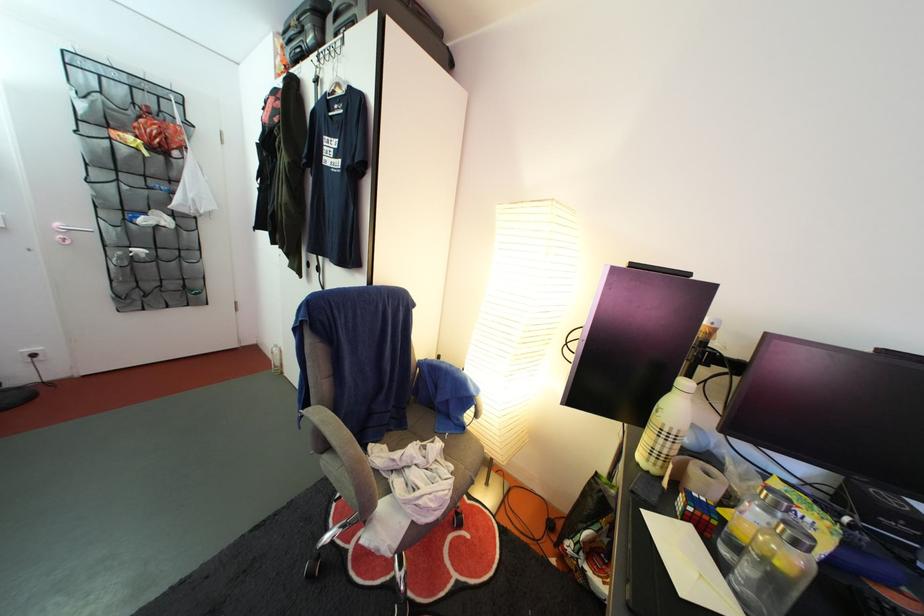
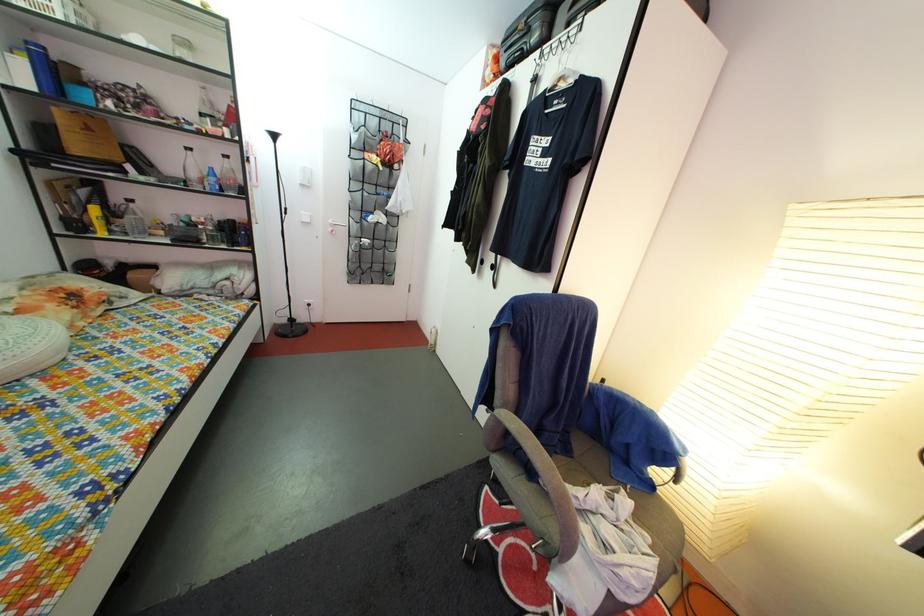
The point at (345, 45) is marked in the first image. Where is the corresponding point in the second image?

(578, 31)